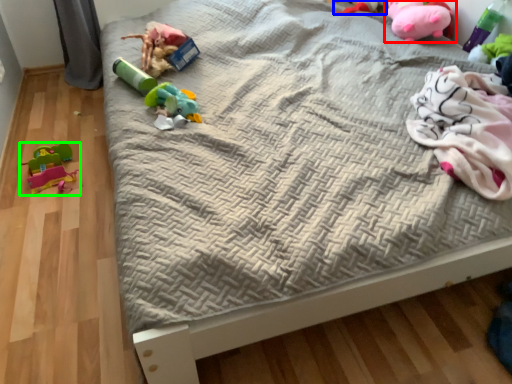
Question: Estimate the real-world distances between objects in this image. Which object is closer to toy (highlighted by a red box), toy (highlighted by a blue box) or toy (highlighted by a green box)?

Choices:
 (A) toy
 (B) toy

Answer: (A)